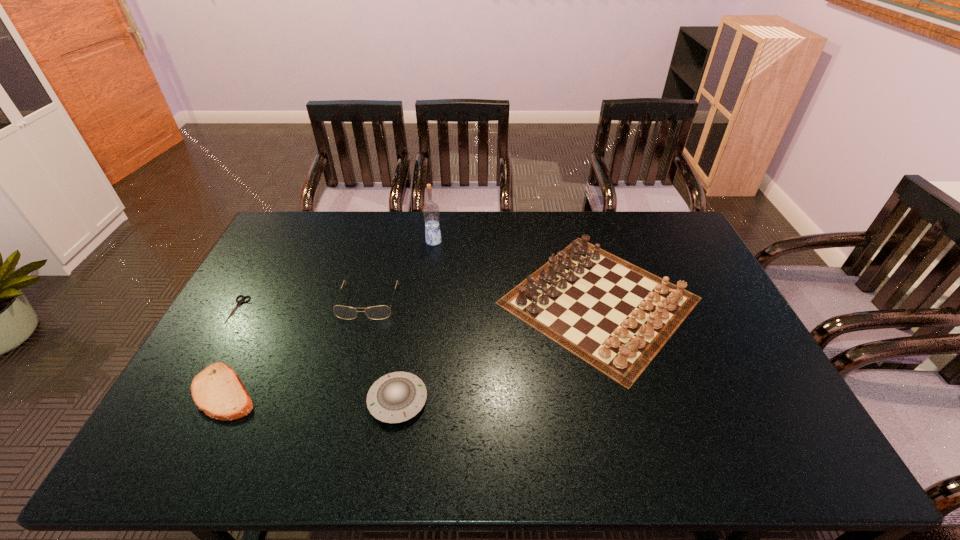
Where is `free spot located 0.100m on the left of the saucer`? The image size is (960, 540). free spot located 0.100m on the left of the saucer is located at coordinates (329, 400).

Identify the location of free region located on the right of the pita bread. (330, 392).

Locate an element on the screen. The width and height of the screenshot is (960, 540). free space located on the back of the shortest object is located at coordinates (260, 269).

I want to click on vodka that is at the far edge, so click(431, 212).

Where is `chessboard at the far edge`? The width and height of the screenshot is (960, 540). chessboard at the far edge is located at coordinates (617, 319).

You are a GUI agent. You are given a task and a screenshot of the screen. Output one action in this format:
    pyautogui.click(x=<x>, y=<y>)
    Task: Click on the pita bread located in the left edge section of the desktop
    
    Given the screenshot: What is the action you would take?
    pyautogui.click(x=217, y=390)

At what (x,y) coordinates should I click in order to perform the action: click on shears positioned at the left edge. Please return your answer as a coordinate pair (x, y). The height and width of the screenshot is (540, 960). Looking at the image, I should click on (239, 302).

The width and height of the screenshot is (960, 540). In order to click on object situated at the right edge in this screenshot , I will do `click(617, 319)`.

Image resolution: width=960 pixels, height=540 pixels. Find the location of `object positioned at the far right corner`. object positioned at the far right corner is located at coordinates (617, 319).

In the image, there is a desktop. Find the location of `vacant space at the far edge`. vacant space at the far edge is located at coordinates (634, 238).